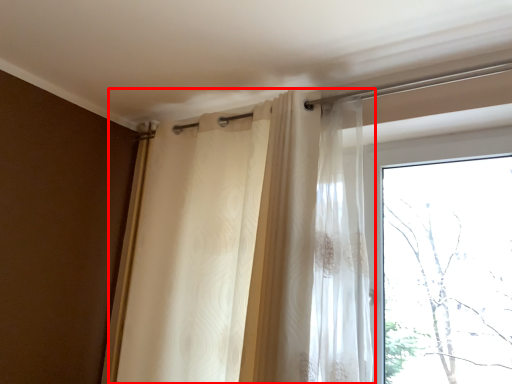
Question: From the image's perspective, where is curtain (annotated by the red box) located in relation to window in the image?

Choices:
 (A) above
 (B) below

Answer: (A)